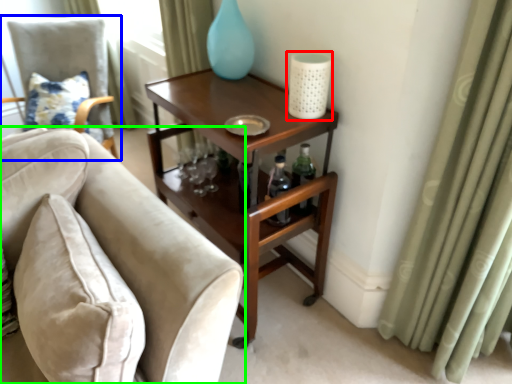
Question: Which object is the farthest from candle holder (highlighted by a red box)? Choose among these: chair (highlighted by a blue box) or chair (highlighted by a green box).

Choices:
 (A) chair
 (B) chair

Answer: (A)